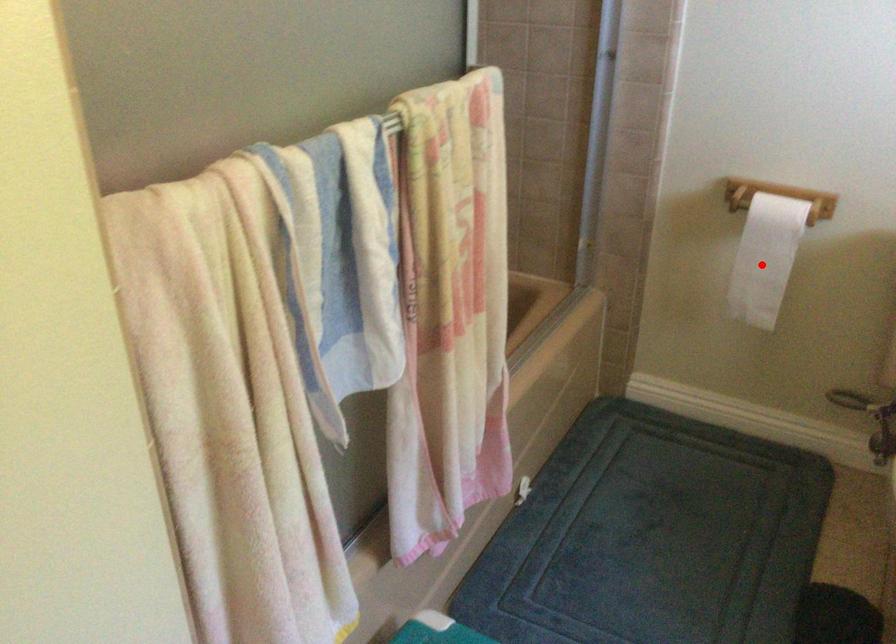
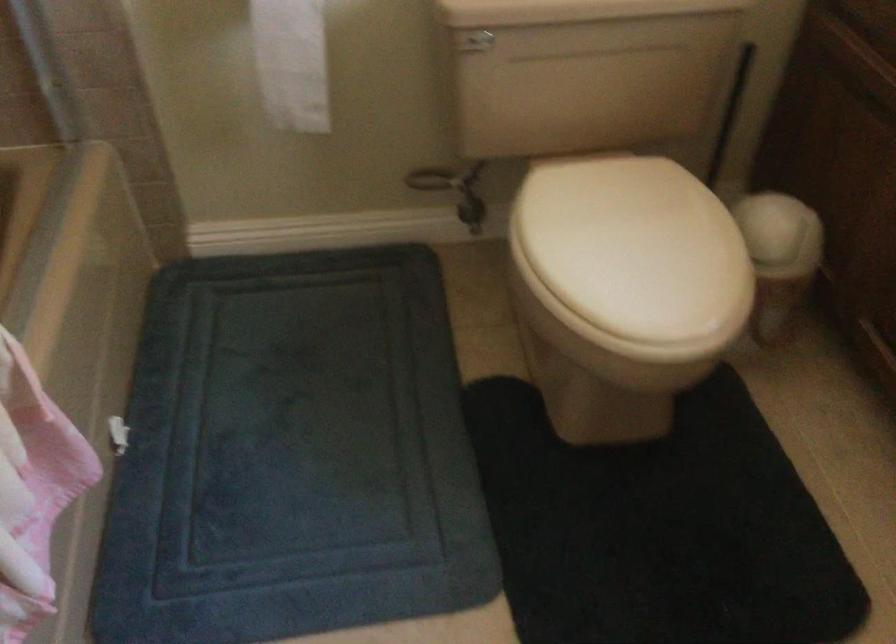
Question: I am providing you with two images of the same scene from different viewpoints. Given a red point in image1, look at the same physical point in image2. Is it:

Choices:
 (A) Closer to the viewpoint
 (B) Farther from the viewpoint

Answer: (A)